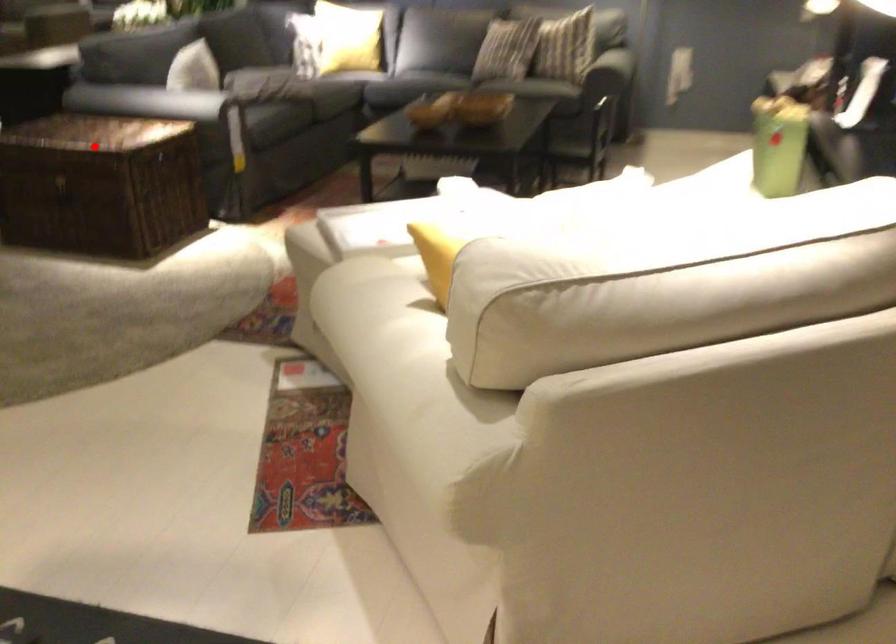
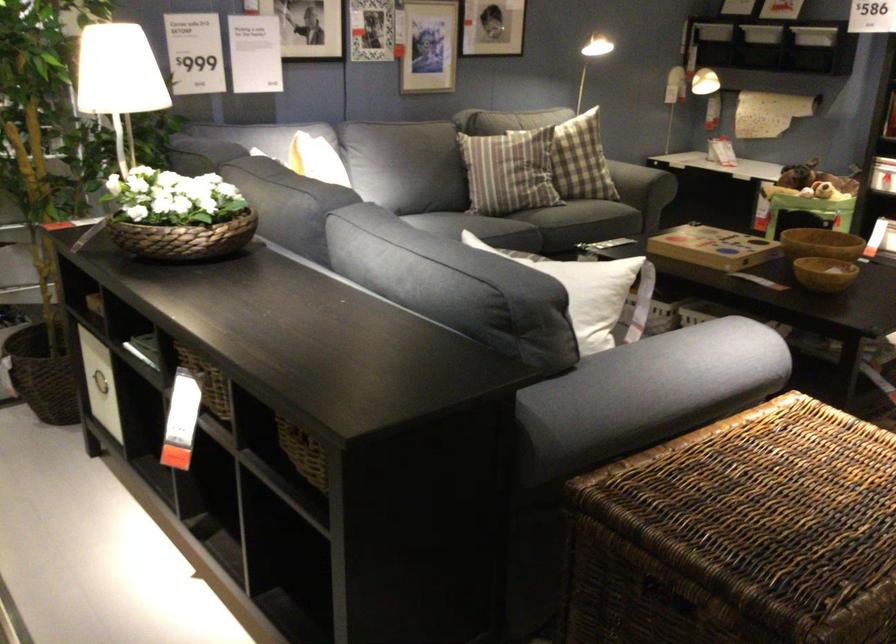
Locate, in the second image, the point that corresponds to the highlighted location in the first image.

(776, 509)